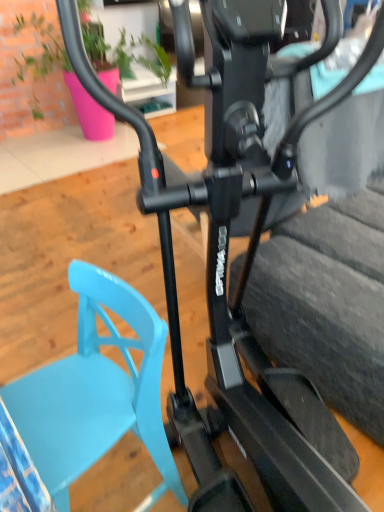
Question: Is there a large distance between light blue plastic swivel chair at lower left and black rubber tire at center?

Choices:
 (A) yes
 (B) no

Answer: (B)

Question: Is the surface of light blue plastic swivel chair at lower left in direct contact with black rubber tire at center?

Choices:
 (A) no
 (B) yes

Answer: (A)

Question: Does light blue plastic swivel chair at lower left have a greater width compared to black rubber tire at center?

Choices:
 (A) no
 (B) yes

Answer: (A)

Question: Is black rubber tire at center located within light blue plastic swivel chair at lower left?

Choices:
 (A) no
 (B) yes

Answer: (A)

Question: Is light blue plastic swivel chair at lower left not inside black rubber tire at center?

Choices:
 (A) yes
 (B) no

Answer: (A)

Question: In the image, is light blue plastic swivel chair at lower left positioned in front of or behind matte green plant at upper center?

Choices:
 (A) front
 (B) behind

Answer: (A)

Question: Based on their sizes in the image, would you say light blue plastic swivel chair at lower left is bigger or smaller than matte green plant at upper center?

Choices:
 (A) big
 (B) small

Answer: (B)

Question: From the image's perspective, is light blue plastic swivel chair at lower left above or below matte green plant at upper center?

Choices:
 (A) above
 (B) below

Answer: (B)

Question: From a real-world perspective, is light blue plastic swivel chair at lower left above or below matte green plant at upper center?

Choices:
 (A) above
 (B) below

Answer: (B)

Question: Considering the positions of light blue plastic swivel chair at lower left and black rubber tire at center in the image, is light blue plastic swivel chair at lower left bigger or smaller than black rubber tire at center?

Choices:
 (A) big
 (B) small

Answer: (B)

Question: Choose the correct answer: Is light blue plastic swivel chair at lower left inside black rubber tire at center or outside it?

Choices:
 (A) inside
 (B) outside

Answer: (B)

Question: Is light blue plastic swivel chair at lower left taller or shorter than black rubber tire at center?

Choices:
 (A) short
 (B) tall

Answer: (A)

Question: In terms of width, does light blue plastic swivel chair at lower left look wider or thinner when compared to black rubber tire at center?

Choices:
 (A) thin
 (B) wide

Answer: (A)

Question: Is point (99, 56) positioned closer to the camera than point (296, 335)?

Choices:
 (A) farther
 (B) closer

Answer: (A)

Question: From their relative heights in the image, would you say matte green plant at upper center is taller or shorter than black rubber tire at center?

Choices:
 (A) short
 (B) tall

Answer: (B)